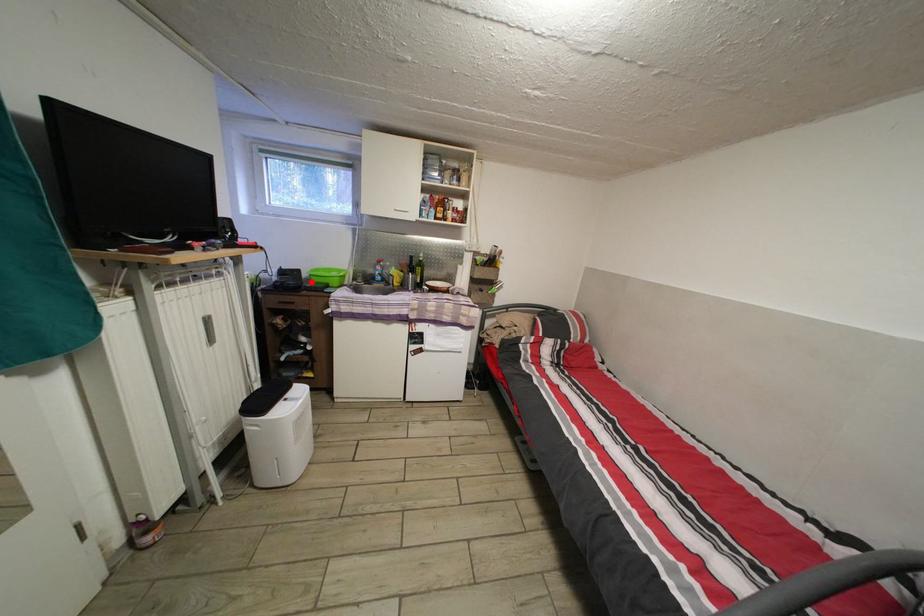
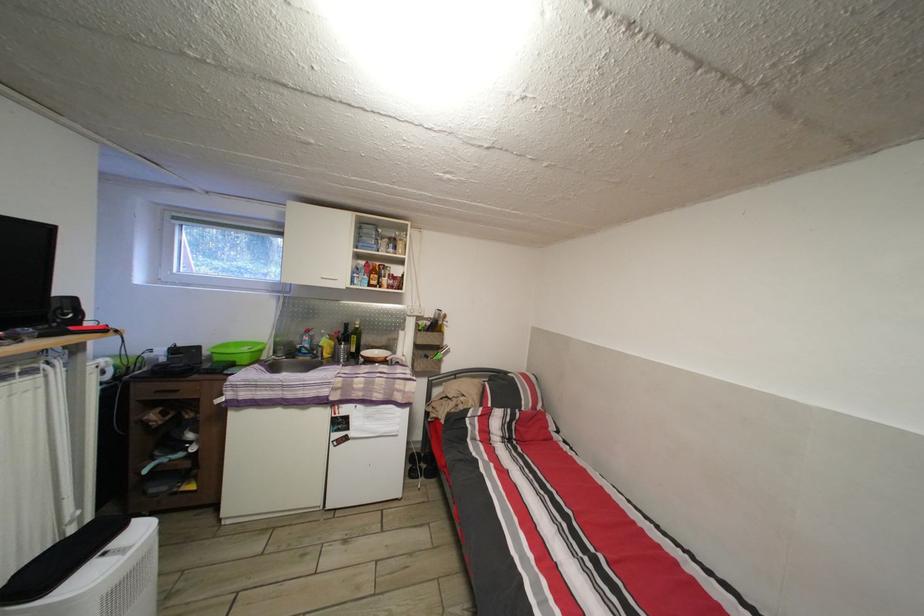
Locate, in the second image, the point that corresponds to the highlighted location in the first image.

(213, 359)